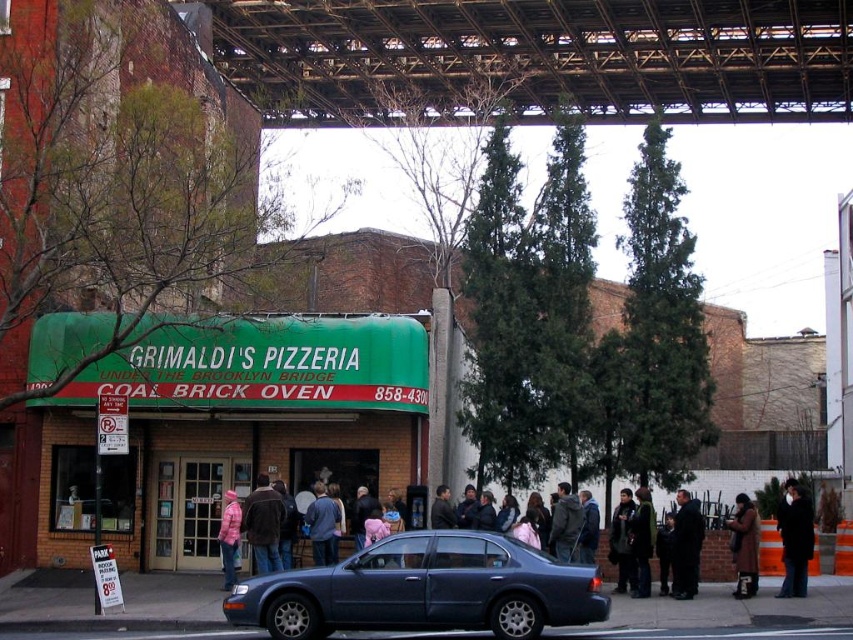
You are standing at the entrance of Grimaldi Pizzeria and see a metallic blue sedan at center and a brown leather jacket at center. Which object is closer to the left side of the entrance?

The brown leather jacket at center is closer to the left side of the entrance because the metallic blue sedan at center is to the right of it.

You are a delivery person trying to reach the Grimaldi Pizzeria entrance, which is behind the metallic blue sedan at center and the brown leather jacket at center. Which object do you need to move around to get closer to the entrance?

The metallic blue sedan at center is shorter than the brown leather jacket at center, so you need to move around the metallic blue sedan at center to get closer to the entrance since it is lower and less obstructive.

You are a delivery person who needs to place a package between the metallic blue sedan at center and the brown leather jacket at center. The package requires a space of 10 meters. Is there enough space between them?

The distance between the metallic blue sedan at center and the brown leather jacket at center is 10.88 meters, so yes, there is enough space to place the package between them since it exceeds the required 10 meters.